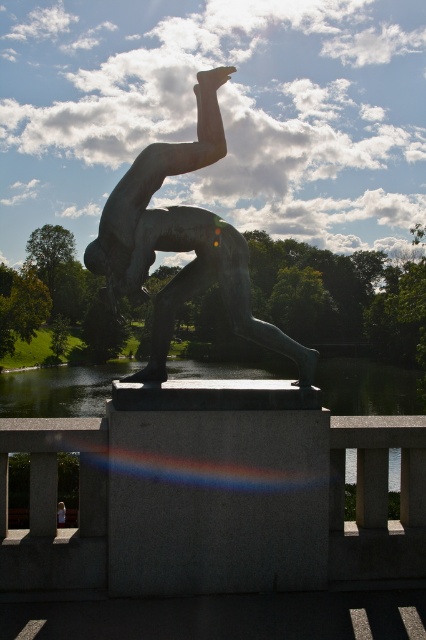
How far apart are bronze statue at center and transparent glass water at center?

bronze statue at center and transparent glass water at center are 41.77 meters apart.

You are a GUI agent. You are given a task and a screenshot of the screen. Output one action in this format:
    pyautogui.click(x=<x>, y=<y>)
    Task: Click on the bronze statue at center
    This screenshot has width=426, height=640.
    Given the screenshot: What is the action you would take?
    pyautogui.click(x=181, y=243)